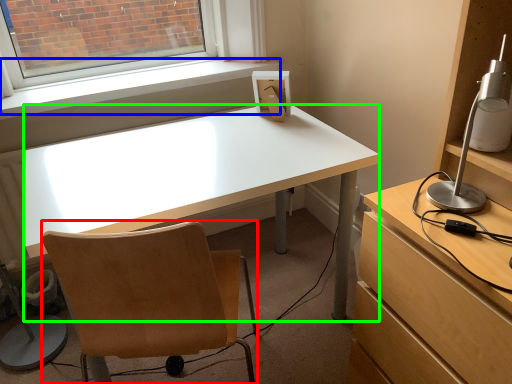
Question: Estimate the real-world distances between objects in this image. Which object is closer to chair (highlighted by a red box), window sill (highlighted by a blue box) or desk (highlighted by a green box)?

Choices:
 (A) window sill
 (B) desk

Answer: (B)